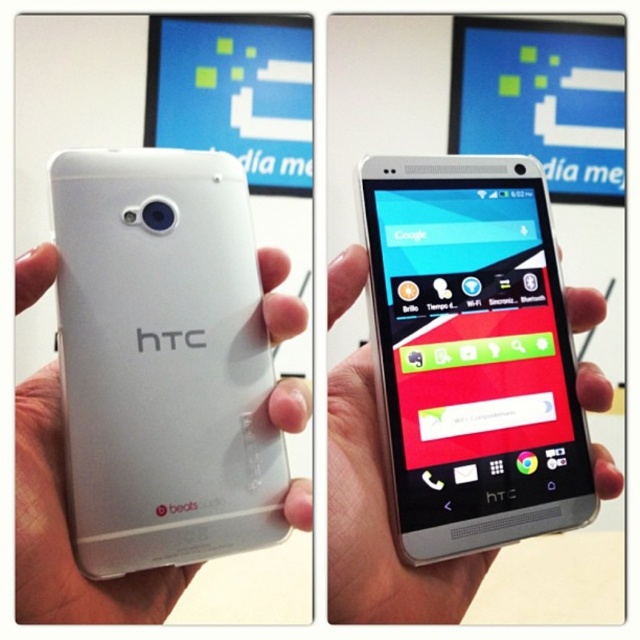
You are holding two phones in your hands. You notice that one is a white matte phone at center and the other is a white matte htc phone at center. If you want to see the screen of the HTC phone, which one should you look behind?

The white matte htc phone at center is behind the white matte phone at center, so you should look behind the white matte phone at center to see the screen of the white matte htc phone at center.

You are holding two phones in your hands. You need to place them on a shelf that is 10 inches wide. Can both the white matte phone at center and the white matte htc phone at center fit side by side without overlapping?

The white matte phone at center is 5.47 inches from white matte htc phone at center. Since the total distance between them is 5.47 inches and the shelf is 10 inches wide, both phones can fit side by side with space to spare.